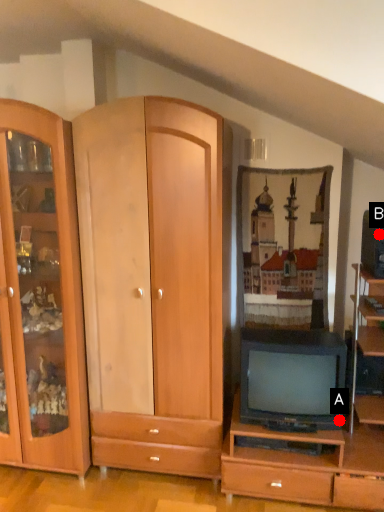
Question: Two points are circled on the image, labeled by A and B beside each circle. Which point is farther from the camera taking this photo?

Choices:
 (A) A is further
 (B) B is further

Answer: (B)